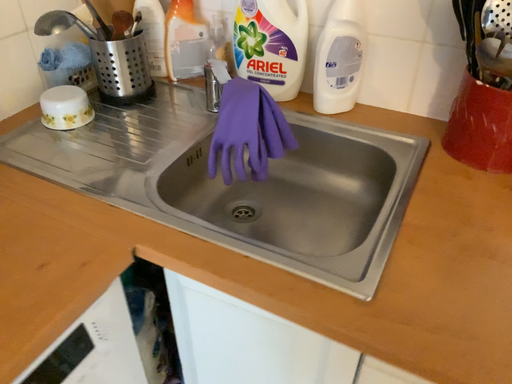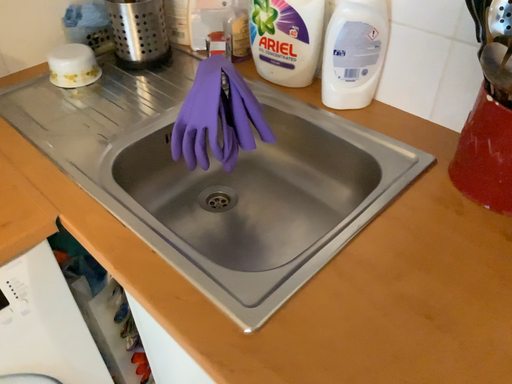
Question: How did the camera likely rotate when shooting the video?

Choices:
 (A) rotated right
 (B) rotated left

Answer: (B)